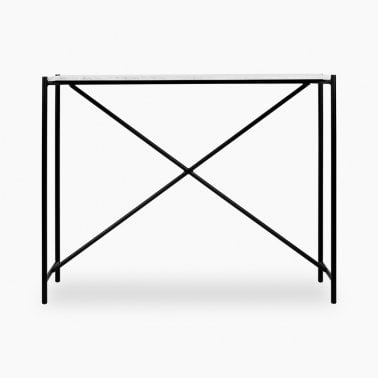
Locate an element on the screen. This screenshot has width=378, height=378. funiture is located at coordinates (60, 78).